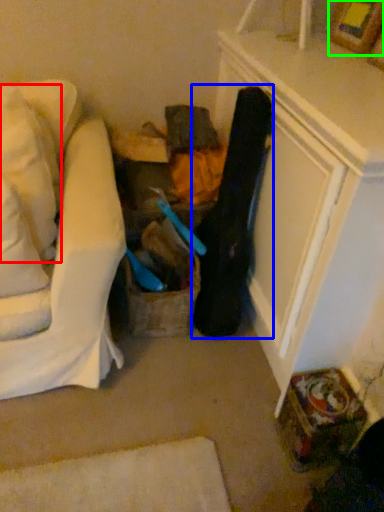
Question: Which object is positioned farthest from pillow (highlighted by a red box)? Select from clothing (highlighted by a blue box) and picture frame (highlighted by a green box).

Choices:
 (A) clothing
 (B) picture frame

Answer: (B)